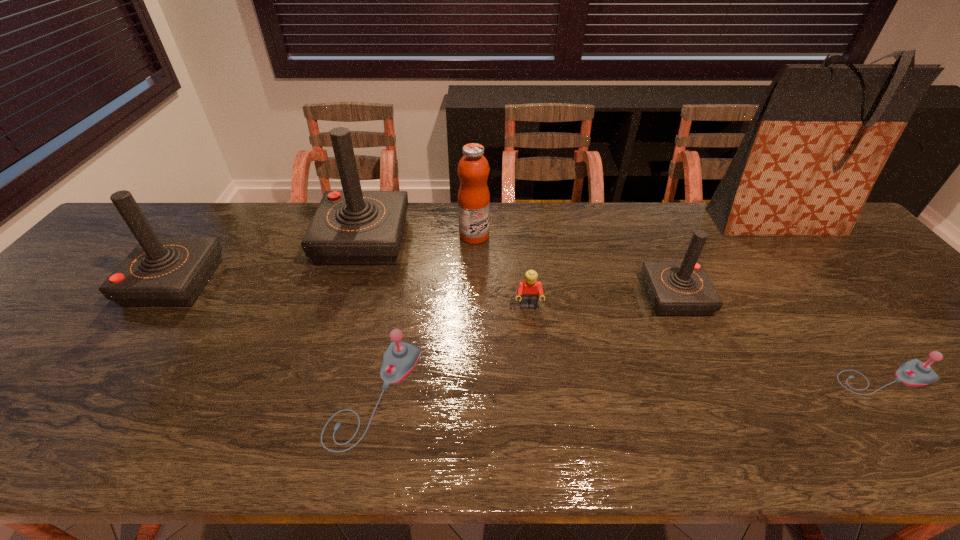
You are a GUI agent. You are given a task and a screenshot of the screen. Output one action in this format:
    pyautogui.click(x=<x>, y=<y>)
    Task: Click on the vacant space that satisfies the following two spatial constraints: 1. on the front-facing side of the tallest object; 2. on the rectangular base of the leftmost red joystick
    
    Given the screenshot: What is the action you would take?
    pyautogui.click(x=824, y=282)

Locate an element on the screen. vacant position in the image that satisfies the following two spatial constraints: 1. on the front-facing side of the shopping bag; 2. on the rectangular base of the smallest red joystick is located at coordinates (836, 296).

This screenshot has width=960, height=540. I want to click on vacant position in the image that satisfies the following two spatial constraints: 1. on the back side of the shortest object; 2. on the rectangular base of the rightmost red joystick, so click(x=820, y=296).

Locate an element on the screen. Image resolution: width=960 pixels, height=540 pixels. free location that satisfies the following two spatial constraints: 1. on the rectangular base of the second joystick from right to left; 2. on the front side of the fourth tallest joystick is located at coordinates (719, 394).